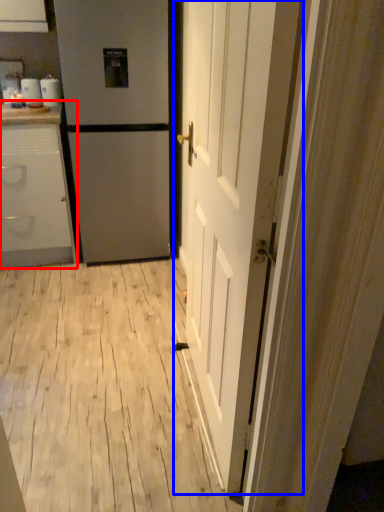
Question: Which object appears farthest to the camera in this image, cabinetry (highlighted by a red box) or door (highlighted by a blue box)?

Choices:
 (A) cabinetry
 (B) door

Answer: (A)